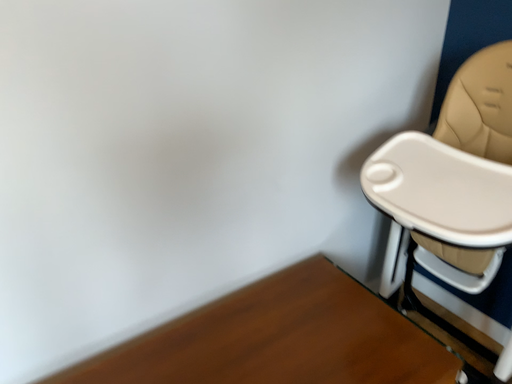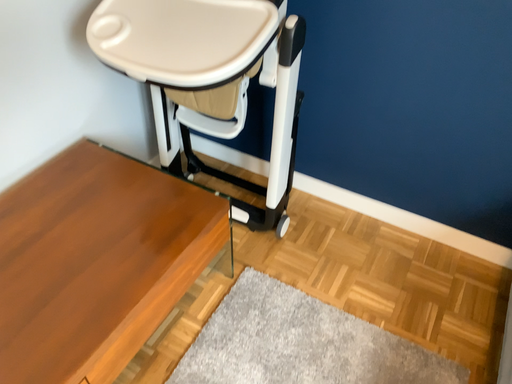
Question: How did the camera likely rotate when shooting the video?

Choices:
 (A) rotated right
 (B) rotated left

Answer: (A)